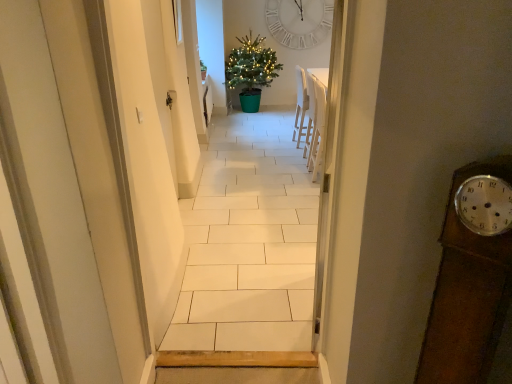
In order to face green glossy plant at center, should I rotate leftwards or rightwards?

It's best to rotate left around 7.153 degrees.

This screenshot has width=512, height=384. What do you see at coordinates (248, 242) in the screenshot?
I see `white tile floor at center` at bounding box center [248, 242].

What is the approximate width of white wooden clock at upper center?

white wooden clock at upper center is 3.74 inches wide.

Measure the distance between point (271, 79) and camera.

7.06 meters.

Find the location of a particular element. Image resolution: width=512 pixels, height=384 pixels. green plastic christmas tree at center is located at coordinates (251, 70).

Where is `green glossy plant at center`? Image resolution: width=512 pixels, height=384 pixels. green glossy plant at center is located at coordinates (203, 70).

Which object is further away from the camera taking this photo, white plastic chair at upper right or green glossy plant at center?

green glossy plant at center is further away from the camera.

Considering the relative sizes of white plastic chair at upper right and green glossy plant at center in the image provided, is white plastic chair at upper right taller than green glossy plant at center?

Indeed, white plastic chair at upper right has a greater height compared to green glossy plant at center.

Can you confirm if white plastic chair at upper right is bigger than green glossy plant at center?

Yes, white plastic chair at upper right is bigger than green glossy plant at center.

Considering the relative sizes of white plastic chair at upper right and green glossy plant at center in the image provided, is white plastic chair at upper right wider than green glossy plant at center?

Yes, white plastic chair at upper right is wider than green glossy plant at center.

How different are the orientations of white wooden clock at upper center and green plastic christmas tree at center in degrees?

1.63 degrees.

Considering the sizes of white wooden clock at upper center and green plastic christmas tree at center in the image, is white wooden clock at upper center wider or thinner than green plastic christmas tree at center?

white wooden clock at upper center is thinner than green plastic christmas tree at center.

From a real-world perspective, is white wooden clock at upper center on green plastic christmas tree at center?

Yes, from a real-world perspective, white wooden clock at upper center is above green plastic christmas tree at center.

Considering the relative sizes of white wooden clock at upper center and green plastic christmas tree at center in the image provided, is white wooden clock at upper center taller than green plastic christmas tree at center?

No.

The width and height of the screenshot is (512, 384). Identify the location of path in front of the green plastic christmas tree at center. (248, 242).

Which is more to the left, green plastic christmas tree at center or white tile floor at center?

Positioned to the left is white tile floor at center.

From the picture: Which is less distant, (265,63) or (277,227)?

Clearly, point (265,63) is more distant from the camera than point (277,227).

Considering the relative positions of green plastic christmas tree at center and white tile floor at center in the image provided, is green plastic christmas tree at center in front of white tile floor at center?

No, it is behind white tile floor at center.

Consider the image. Could you tell me if white tile floor at center is facing white plastic chair at upper right?

Yes.

Based on the photo, between white tile floor at center and white plastic chair at upper right, which one is positioned behind?

white plastic chair at upper right is more distant.

Between white tile floor at center and white plastic chair at upper right, which one has smaller width?

white tile floor at center.

Can you confirm if white tile floor at center is bigger than white plastic chair at upper right?

Yes.

Which point is more forward, (320,116) or (325,32)?

The point (320,116) is closer.

In the scene shown: From the image's perspective, relative to white wooden clock at upper center, is white plastic chair at upper right above or below?

Clearly, from the image's perspective, white plastic chair at upper right is below white wooden clock at upper center.

Where is `clock on the right of the white plastic chair at upper right`? The image size is (512, 384). clock on the right of the white plastic chair at upper right is located at coordinates (298, 22).

Is white plastic chair at upper right looking in the opposite direction of white wooden clock at upper center?

No, white wooden clock at upper center is not at the back of white plastic chair at upper right.

Does white plastic chair at upper right turn towards white tile floor at center?

No, white plastic chair at upper right is not facing towards white tile floor at center.

Find the location of `chair behind the white tile floor at center`. chair behind the white tile floor at center is located at coordinates (317, 127).

Can you confirm if white plastic chair at upper right is wider than white tile floor at center?

Indeed, white plastic chair at upper right has a greater width compared to white tile floor at center.

In the scene shown: Which is correct: white wooden clock at upper center is inside white plastic chair at upper right, or outside of it?

white wooden clock at upper center lies outside white plastic chair at upper right.

From their relative heights in the image, would you say white wooden clock at upper center is taller or shorter than white plastic chair at upper right?

white wooden clock at upper center is shorter than white plastic chair at upper right.

Considering the sizes of white wooden clock at upper center and white plastic chair at upper right in the image, is white wooden clock at upper center bigger or smaller than white plastic chair at upper right?

white wooden clock at upper center is bigger than white plastic chair at upper right.

From the picture: Considering the relative positions of white wooden clock at upper center and white plastic chair at upper right in the image provided, is white wooden clock at upper center behind white plastic chair at upper right?

Yes.

Find the location of a particular element. The image size is (512, 384). chair in front of the green glossy plant at center is located at coordinates click(x=317, y=127).

Find the location of `clock above the green plastic christmas tree at center (from the image's perspective)`. clock above the green plastic christmas tree at center (from the image's perspective) is located at coordinates (298, 22).

Looking at the image, which one is located further to white plastic chair at upper right, white wooden clock at upper center or green plastic christmas tree at center?

The object further to white plastic chair at upper right is white wooden clock at upper center.

Looking at the image, which one is located closer to green glossy plant at center, white tile floor at center or white plastic chair at upper right?

white plastic chair at upper right.

From the image, which object appears to be farther from green glossy plant at center, white plastic chair at upper right or white wooden clock at upper center?

Among the two, white plastic chair at upper right is located further to green glossy plant at center.

Considering their positions, is white tile floor at center positioned closer to white wooden clock at upper center than white plastic chair at upper right?

The object closer to white wooden clock at upper center is white tile floor at center.

Based on their spatial positions, is green glossy plant at center or white wooden clock at upper center closer to white plastic chair at upper right?

green glossy plant at center lies closer to white plastic chair at upper right than the other object.

From the image, which object appears to be farther from white tile floor at center, white wooden clock at upper center or green glossy plant at center?

Based on the image, green glossy plant at center appears to be further to white tile floor at center.

Looking at this image, considering their positions, is white plastic chair at upper right positioned further to white wooden clock at upper center than white tile floor at center?

white plastic chair at upper right is positioned further to the anchor white wooden clock at upper center.

From the image, which object appears to be farther from green plastic christmas tree at center, white plastic chair at upper right or green glossy plant at center?

white plastic chair at upper right is further to green plastic christmas tree at center.

What are the coordinates of `christmas tree located between white plastic chair at upper right and green glossy plant at center in the depth direction` in the screenshot? It's located at (251, 70).

Where is `christmas tree located between white tile floor at center and white wooden clock at upper center in the depth direction`? This screenshot has width=512, height=384. christmas tree located between white tile floor at center and white wooden clock at upper center in the depth direction is located at coordinates coord(251,70).

Locate an element on the screen. The image size is (512, 384). houseplant between white plastic chair at upper right and white wooden clock at upper center along the z-axis is located at coordinates (203, 70).

Locate an element on the screen. This screenshot has height=384, width=512. chair between white tile floor at center and white wooden clock at upper center from front to back is located at coordinates (317, 127).